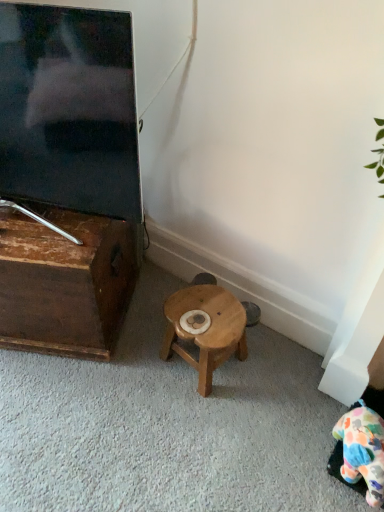
Question: Can you confirm if wooden table at left is wider than matte black tv at left?

Choices:
 (A) no
 (B) yes

Answer: (B)

Question: Is wooden table at left bigger than matte black tv at left?

Choices:
 (A) yes
 (B) no

Answer: (A)

Question: Considering the relative positions of wooden table at left and matte black tv at left in the image provided, is wooden table at left to the right of matte black tv at left from the viewer's perspective?

Choices:
 (A) no
 (B) yes

Answer: (A)

Question: From the image's perspective, is wooden table at left beneath matte black tv at left?

Choices:
 (A) no
 (B) yes

Answer: (B)

Question: From the image's perspective, is wooden table at left over matte black tv at left?

Choices:
 (A) yes
 (B) no

Answer: (B)

Question: Relative to wooden stool at center, is fluffy multicolored plush at lower right in front or behind?

Choices:
 (A) front
 (B) behind

Answer: (A)

Question: From the image's perspective, relative to wooden stool at center, is fluffy multicolored plush at lower right above or below?

Choices:
 (A) below
 (B) above

Answer: (A)

Question: From a real-world perspective, relative to wooden stool at center, is fluffy multicolored plush at lower right vertically above or below?

Choices:
 (A) above
 (B) below

Answer: (A)

Question: Considering the positions of fluffy multicolored plush at lower right and wooden stool at center in the image, is fluffy multicolored plush at lower right taller or shorter than wooden stool at center?

Choices:
 (A) tall
 (B) short

Answer: (B)

Question: Is matte black tv at left inside or outside of wooden table at left?

Choices:
 (A) inside
 (B) outside

Answer: (B)

Question: From a real-world perspective, is matte black tv at left above or below wooden table at left?

Choices:
 (A) above
 (B) below

Answer: (A)

Question: Considering their positions, is matte black tv at left located in front of or behind wooden table at left?

Choices:
 (A) behind
 (B) front

Answer: (B)

Question: Based on their positions, is matte black tv at left located to the left or right of wooden table at left?

Choices:
 (A) right
 (B) left

Answer: (A)

Question: Would you say wooden table at left is to the left or to the right of matte black tv at left in the picture?

Choices:
 (A) left
 (B) right

Answer: (A)

Question: From a real-world perspective, is wooden table at left positioned above or below matte black tv at left?

Choices:
 (A) above
 (B) below

Answer: (B)